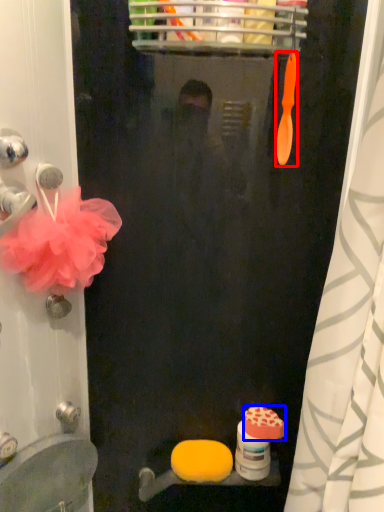
Question: Which object is further to the camera taking this photo, brush (highlighted by a red box) or soap (highlighted by a blue box)?

Choices:
 (A) brush
 (B) soap

Answer: (B)